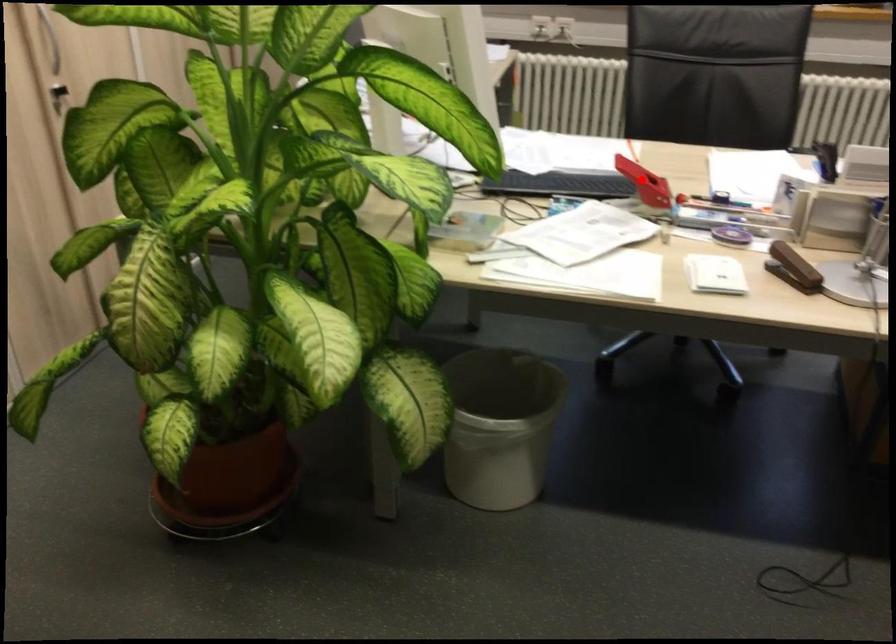
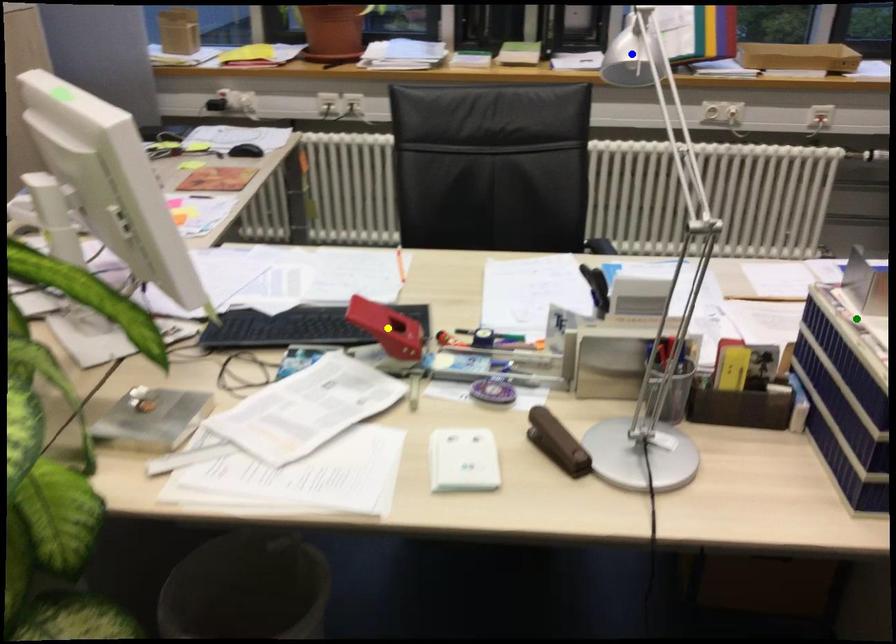
Question: I am providing you with two images of the same scene from different viewpoints. A red point is marked on the first image. You are given multiple points on the second image. In image 2, which mark is for the same physical point as the one in image 1?

Choices:
 (A) yellow point
 (B) green point
 (C) blue point

Answer: (A)